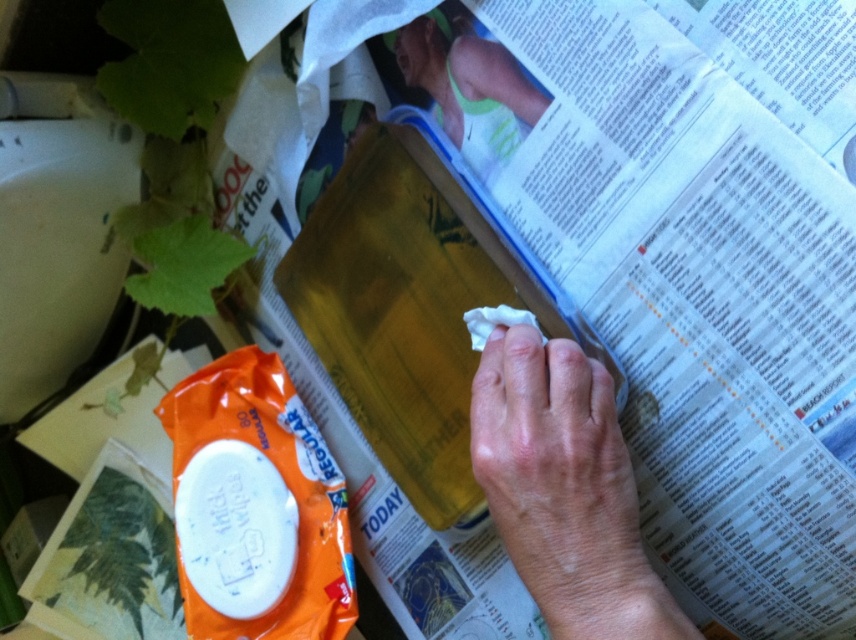
Question: Can you confirm if dry skin at center is positioned above skinny green tank top at upper center?

Choices:
 (A) no
 (B) yes

Answer: (A)

Question: Does dry skin at center appear on the left side of skinny green tank top at upper center?

Choices:
 (A) yes
 (B) no

Answer: (B)

Question: Which point is closer to the camera?

Choices:
 (A) skinny green tank top at upper center
 (B) dry skin at center

Answer: (B)

Question: Is dry skin at center below skinny green tank top at upper center?

Choices:
 (A) no
 (B) yes

Answer: (B)